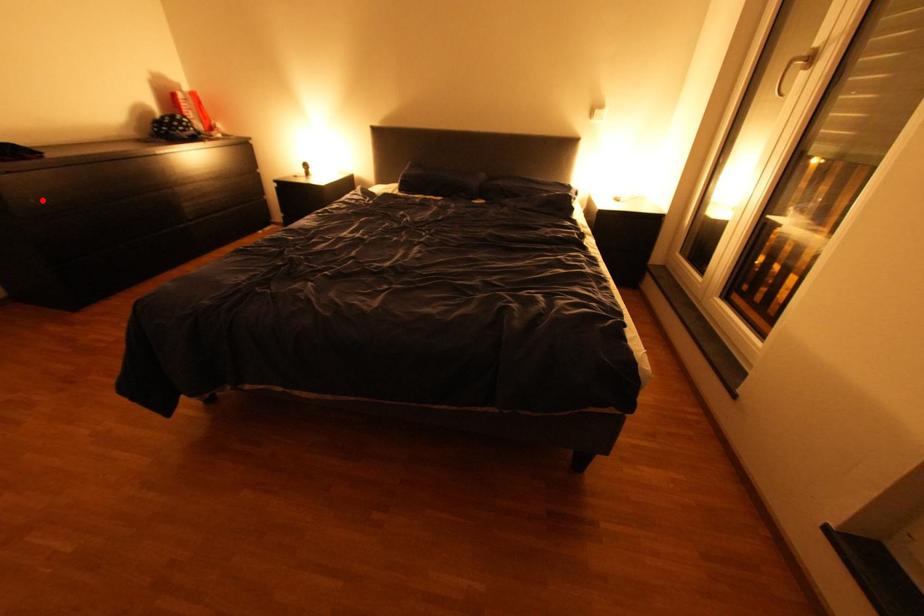
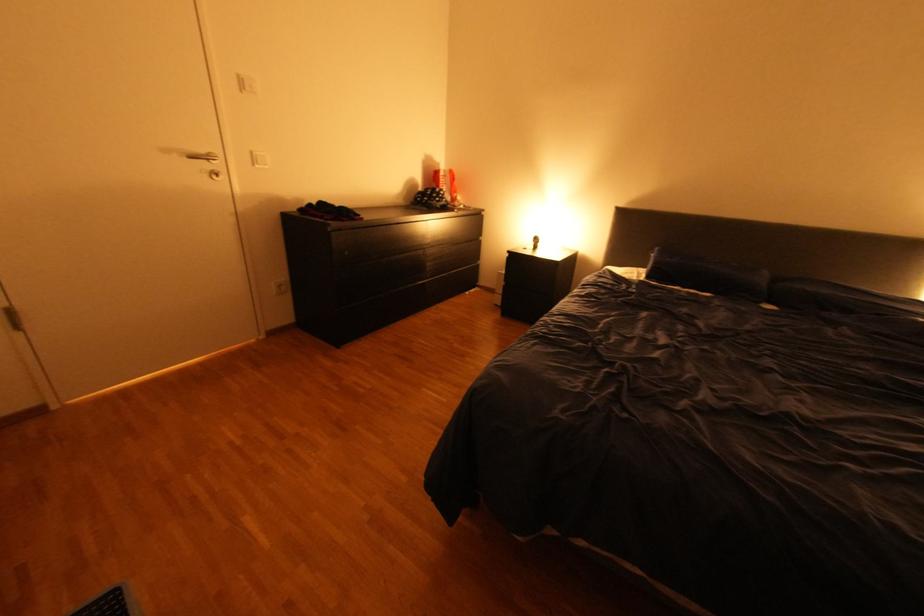
Locate, in the second image, the point that corresponds to the highlighted location in the first image.

(357, 253)